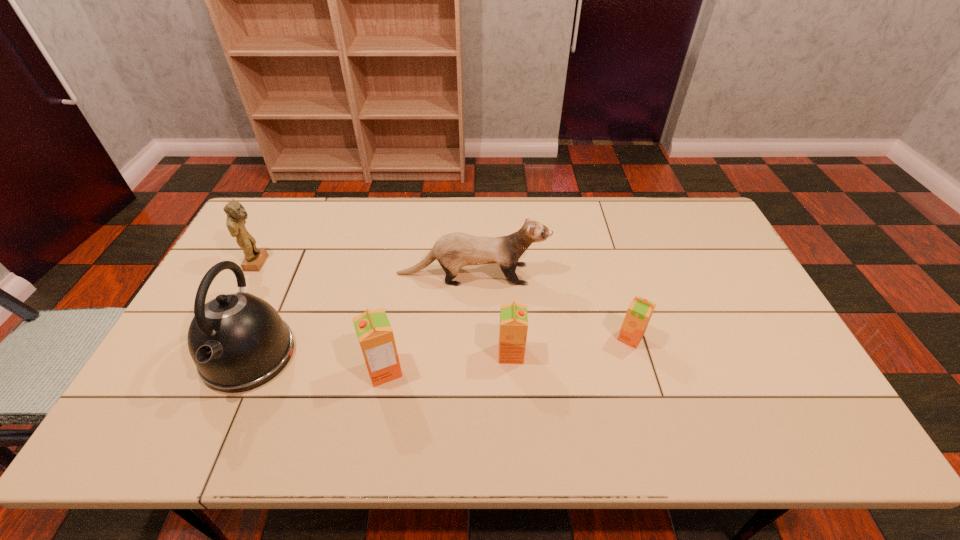
In the image, there is a desktop. Where is `vacant space at the far left corner`? The width and height of the screenshot is (960, 540). vacant space at the far left corner is located at coordinates (293, 210).

The height and width of the screenshot is (540, 960). In the image, there is a desktop. Find the location of `vacant space at the near left corner`. vacant space at the near left corner is located at coordinates (191, 382).

I want to click on vacant area at the far right corner of the desktop, so click(x=695, y=238).

I want to click on empty space that is in between the rightmost orange juice and the ferret, so click(551, 306).

The image size is (960, 540). What are the coordinates of `free spot between the figurine and the leftmost orange juice` in the screenshot? It's located at (321, 316).

This screenshot has height=540, width=960. I want to click on vacant space that is in between the second tallest orange juice and the shortest orange juice, so click(x=570, y=346).

Identify the location of vacant space in between the rightmost orange juice and the figurine. (444, 300).

Locate an element on the screen. unoccupied position between the second orange juice from left to right and the ferret is located at coordinates (492, 314).

Identify the location of free area in between the leftmost orange juice and the ferret. (428, 322).

Locate an element on the screen. Image resolution: width=960 pixels, height=540 pixels. free point between the leftmost orange juice and the figurine is located at coordinates (321, 316).